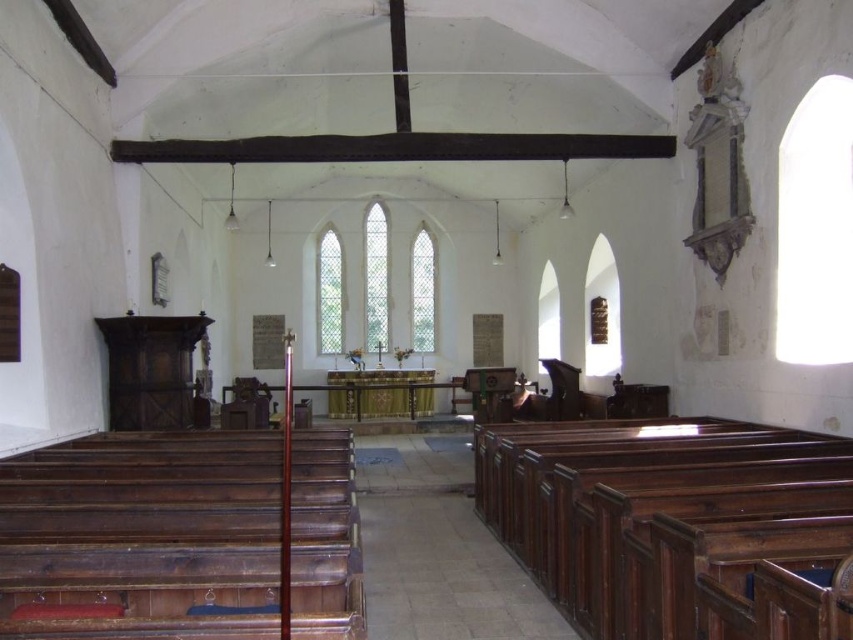
Question: Can you confirm if dark brown polished wood church bench at left is positioned below dark wood beam at center?

Choices:
 (A) yes
 (B) no

Answer: (A)

Question: Which point is closer to the camera?

Choices:
 (A) dark wood beam at center
 (B) dark brown polished wood church bench at left
 (C) dark brown polished wood church bench at lower right

Answer: (B)

Question: Which is farther from the dark wood beam at center?

Choices:
 (A) dark brown polished wood church bench at lower right
 (B) dark brown polished wood church bench at left

Answer: (A)

Question: Is dark brown polished wood church bench at lower right bigger than dark wood beam at center?

Choices:
 (A) yes
 (B) no

Answer: (B)

Question: Which object is closer to the camera taking this photo?

Choices:
 (A) dark brown polished wood church bench at lower right
 (B) dark brown polished wood church bench at left
 (C) dark wood beam at center

Answer: (B)

Question: Is dark brown polished wood church bench at lower right wider than dark wood beam at center?

Choices:
 (A) yes
 (B) no

Answer: (B)